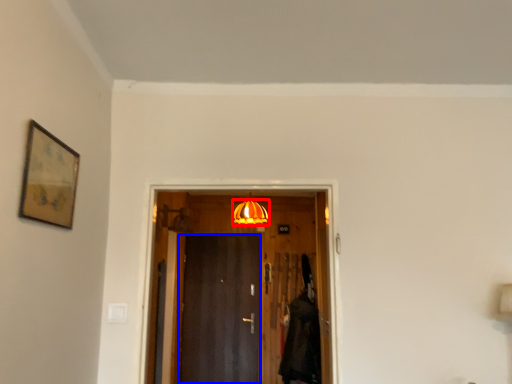
Question: Which of the following is the farthest to the observer, lamp (highlighted by a red box) or door (highlighted by a blue box)?

Choices:
 (A) lamp
 (B) door

Answer: (B)